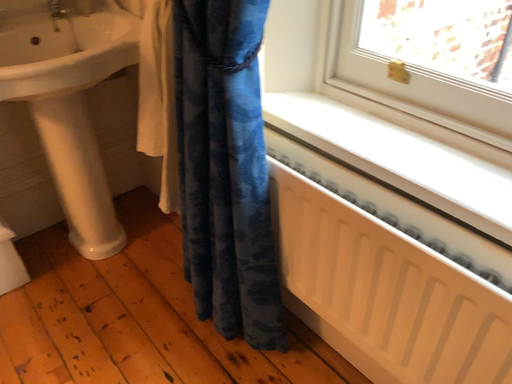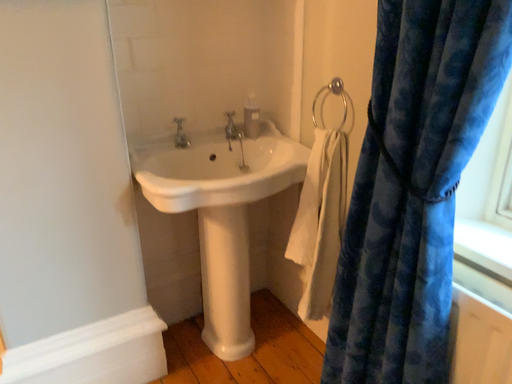
Question: How did the camera likely rotate when shooting the video?

Choices:
 (A) rotated left
 (B) rotated right

Answer: (A)